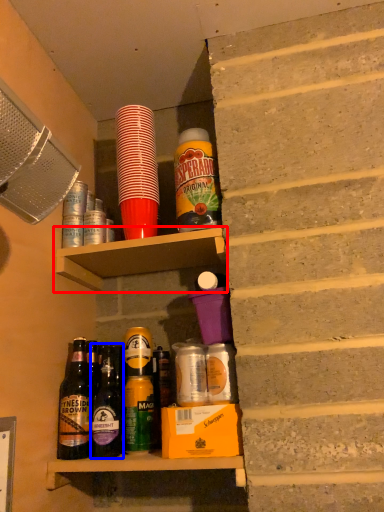
Question: Which object appears farthest to the camera in this image, shelf (highlighted by a red box) or bottle (highlighted by a blue box)?

Choices:
 (A) shelf
 (B) bottle

Answer: (A)